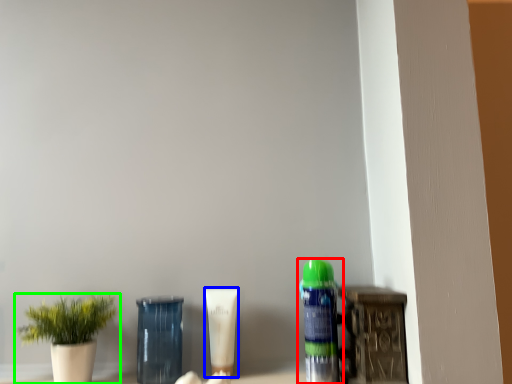
Question: Considering the real-world distances, which object is farthest from bottle (highlighted by a red box)? product (highlighted by a blue box) or houseplant (highlighted by a green box)?

Choices:
 (A) product
 (B) houseplant

Answer: (B)